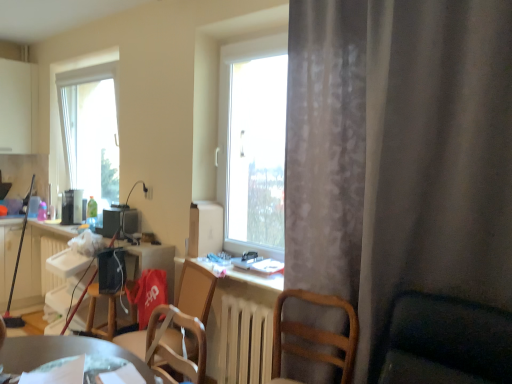
At what (x,y) coordinates should I click in order to perform the action: click on empty space that is ontop of white matte radiator at center, the 1th radiator positioned from the front (from a real-world perspective). Please return your answer as a coordinate pair (x, y). This screenshot has width=512, height=384. Looking at the image, I should click on (251, 302).